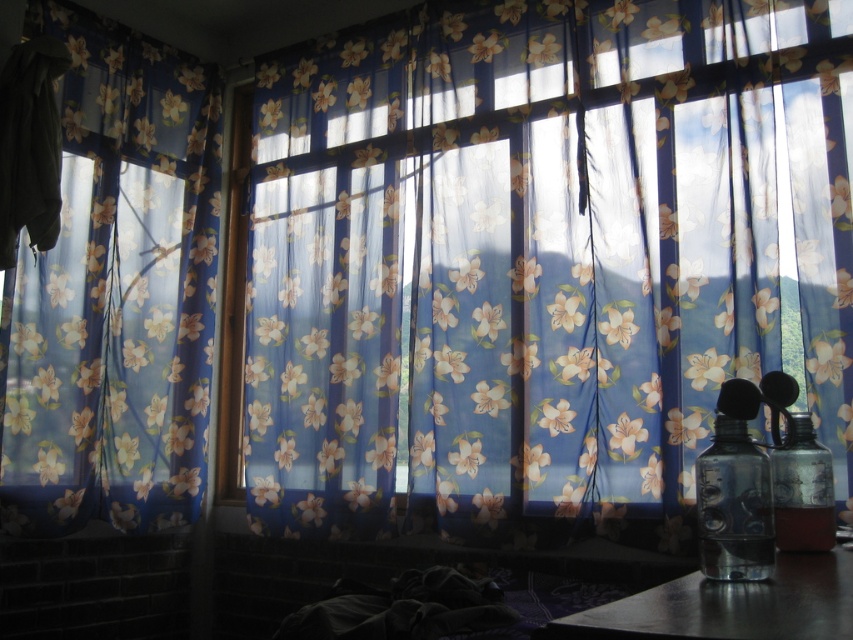
From the picture: You are standing in the room and want to touch both the floral sheer curtains at center and the metallic dark gray table at lower right. Which object will you reach first?

The floral sheer curtains at center will be reached first because they are closer to you than the metallic dark gray table at lower right, which is further away.

You are arranging items on a table and need to place both the metallic dark gray table at lower right and the translucent plastic bottle at right. Which object should you place first to ensure stability?

The metallic dark gray table at lower right should be placed first because it is shorter than the translucent plastic bottle at right, ensuring a stable base for the taller bottle.